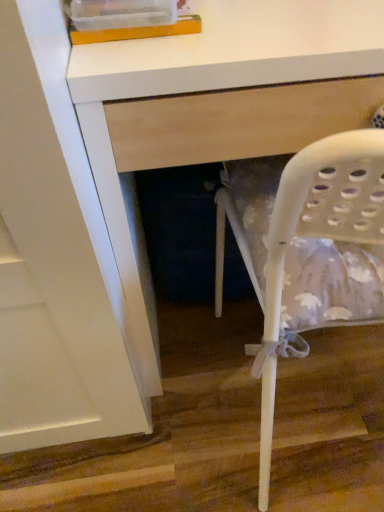
Measure the distance between point (365, 241) and camera.

Point (365, 241) is 16.14 inches away from camera.

The height and width of the screenshot is (512, 384). I want to click on white plastic chair at right, so click(306, 250).

The image size is (384, 512). Describe the element at coordinates (306, 250) in the screenshot. I see `white plastic chair at right` at that location.

Where is `white plastic chair at right`? The width and height of the screenshot is (384, 512). white plastic chair at right is located at coordinates (306, 250).